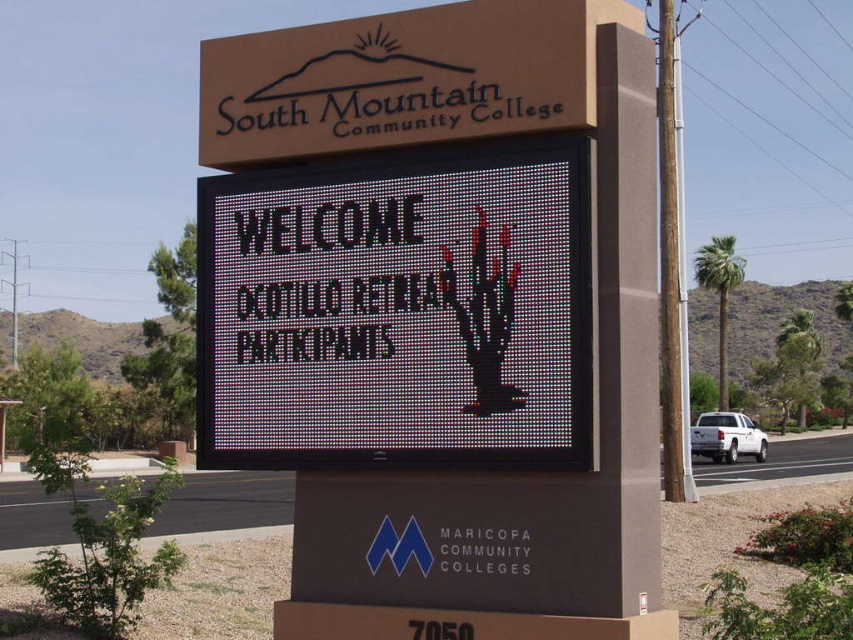
Can you confirm if matte black sign at center is smaller than black pixelated cactus at center?

Yes.

You are a GUI agent. You are given a task and a screenshot of the screen. Output one action in this format:
    pyautogui.click(x=<x>, y=<y>)
    Task: Click on the matte black sign at center
    This screenshot has width=853, height=640.
    Given the screenshot: What is the action you would take?
    pyautogui.click(x=450, y=308)